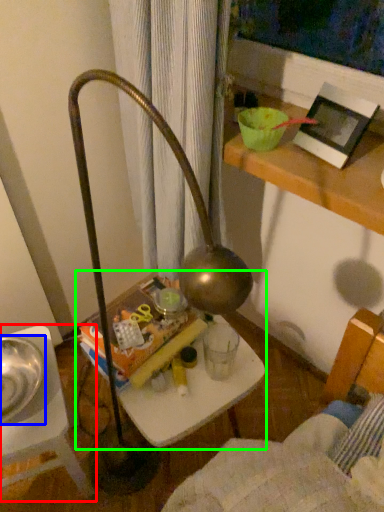
Question: Based on their relative distances, which object is nearer to furniture (highlighted by a red box)? Choose from glass bowl (highlighted by a blue box) and table (highlighted by a green box).

Choices:
 (A) glass bowl
 (B) table

Answer: (A)